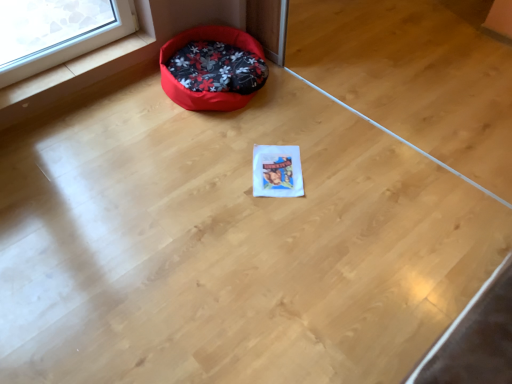
The height and width of the screenshot is (384, 512). Identify the location of free spot to the right of floral fabric dog bed at upper left. (303, 112).